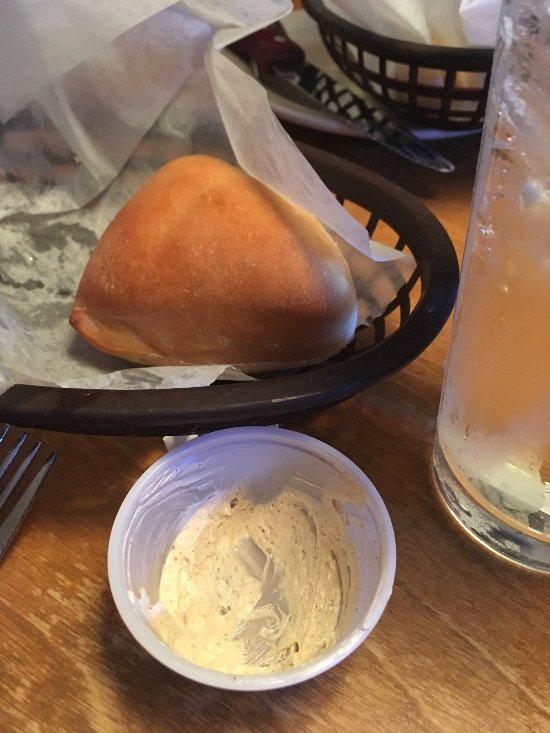
Where is `basket`? The width and height of the screenshot is (550, 733). basket is located at coordinates pos(329,380).